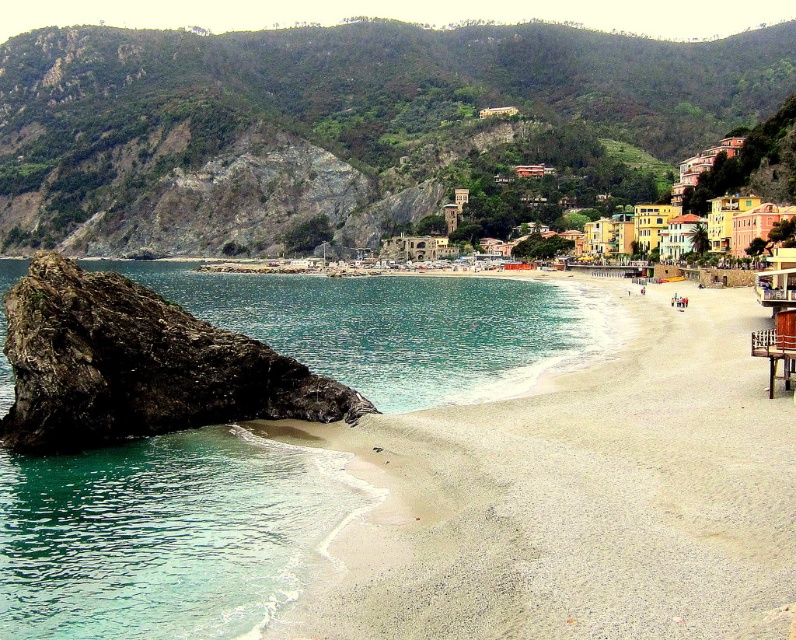
Question: Among these objects, which one is farthest from the camera?

Choices:
 (A) white sandy beach at lower left
 (B) green rocky hillside at upper center

Answer: (B)

Question: Can you confirm if green rocky hillside at upper center is positioned to the right of white sandy beach at lower left?

Choices:
 (A) no
 (B) yes

Answer: (A)

Question: Can you confirm if green rocky hillside at upper center is positioned to the left of white sandy beach at lower left?

Choices:
 (A) no
 (B) yes

Answer: (B)

Question: Is green rocky hillside at upper center smaller than white sandy beach at lower left?

Choices:
 (A) no
 (B) yes

Answer: (A)